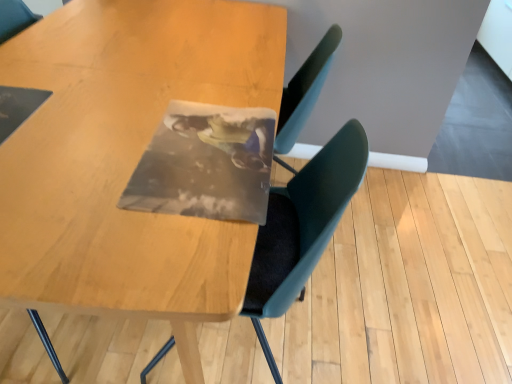
Question: Is the position of wooden table at center less distant than that of matte plastic photo frame at center?

Choices:
 (A) no
 (B) yes

Answer: (B)

Question: Is wooden table at center touching matte plastic photo frame at center?

Choices:
 (A) yes
 (B) no

Answer: (B)

Question: Is wooden table at center looking in the opposite direction of matte plastic photo frame at center?

Choices:
 (A) no
 (B) yes

Answer: (B)

Question: Considering the relative sizes of wooden table at center and matte plastic photo frame at center in the image provided, is wooden table at center bigger than matte plastic photo frame at center?

Choices:
 (A) no
 (B) yes

Answer: (B)

Question: Is wooden table at center taller than matte plastic photo frame at center?

Choices:
 (A) no
 (B) yes

Answer: (A)

Question: Does wooden table at center turn towards matte plastic photo frame at center?

Choices:
 (A) no
 (B) yes

Answer: (B)

Question: Is matte plastic photo frame at center oriented towards wooden table at center?

Choices:
 (A) yes
 (B) no

Answer: (A)

Question: Is matte plastic photo frame at center looking in the opposite direction of wooden table at center?

Choices:
 (A) yes
 (B) no

Answer: (A)

Question: Is matte plastic photo frame at center next to wooden table at center and touching it?

Choices:
 (A) yes
 (B) no

Answer: (B)

Question: Is matte plastic photo frame at center wider than wooden table at center?

Choices:
 (A) yes
 (B) no

Answer: (B)

Question: Does matte plastic photo frame at center lie in front of wooden table at center?

Choices:
 (A) yes
 (B) no

Answer: (B)

Question: Is matte plastic photo frame at center completely or partially outside of wooden table at center?

Choices:
 (A) yes
 (B) no

Answer: (B)

Question: Is point (307, 198) positioned closer to the camera than point (39, 206)?

Choices:
 (A) farther
 (B) closer

Answer: (A)